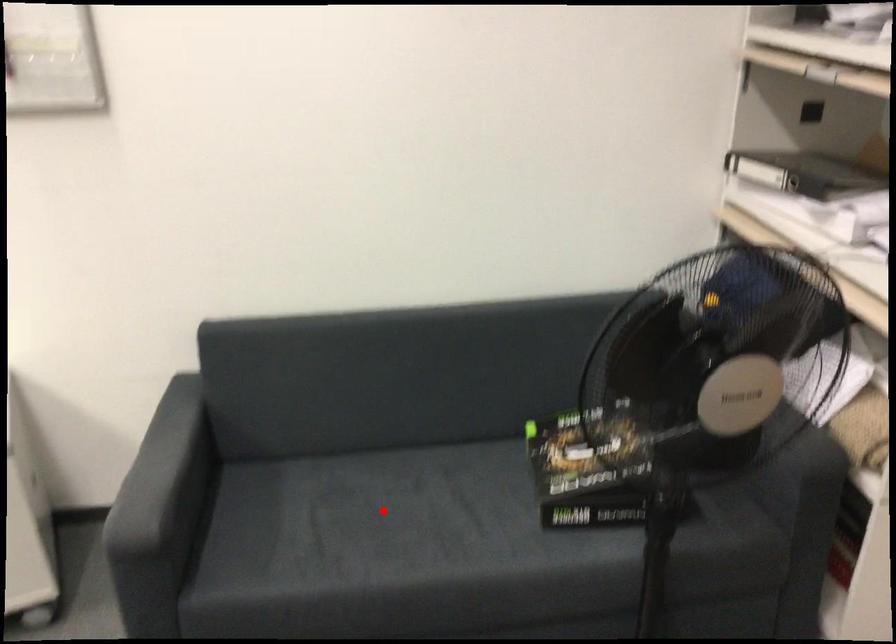
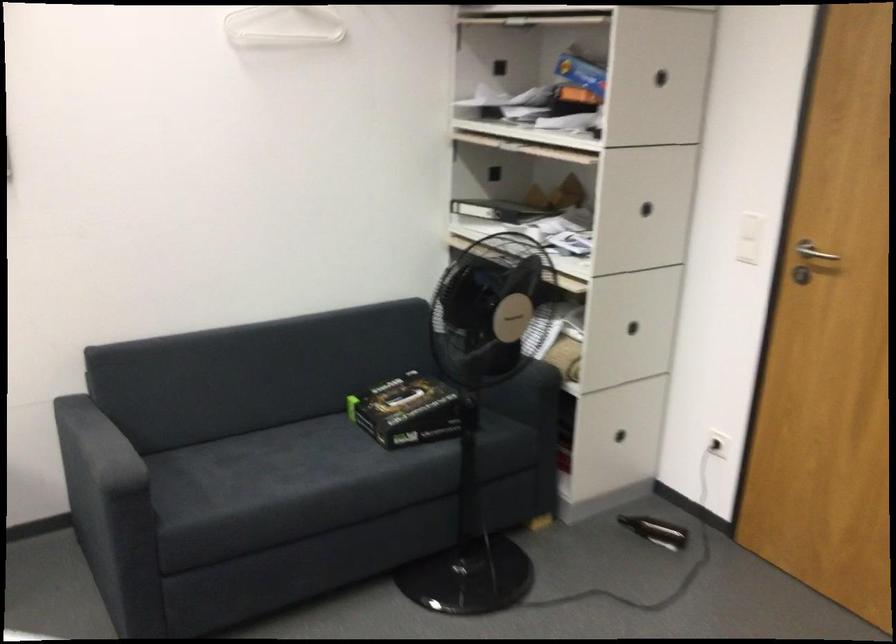
Question: I am providing you with two images of the same scene from different viewpoints. In image1, a red point is highlighted. Considering the same 3D point in image2, which of the following is correct?

Choices:
 (A) It is closer
 (B) It is farther

Answer: (B)